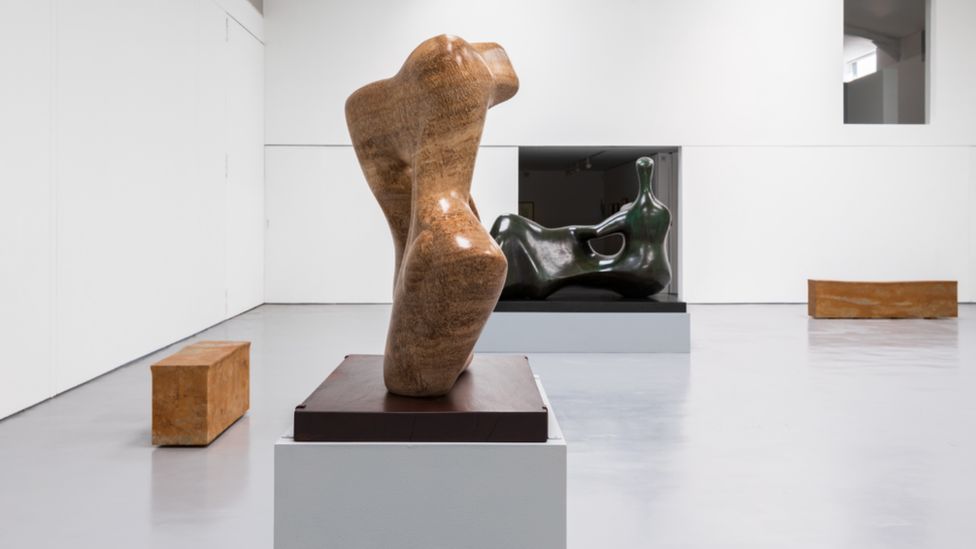
In order to click on white far wall in this screenshot , I will do `click(618, 72)`.